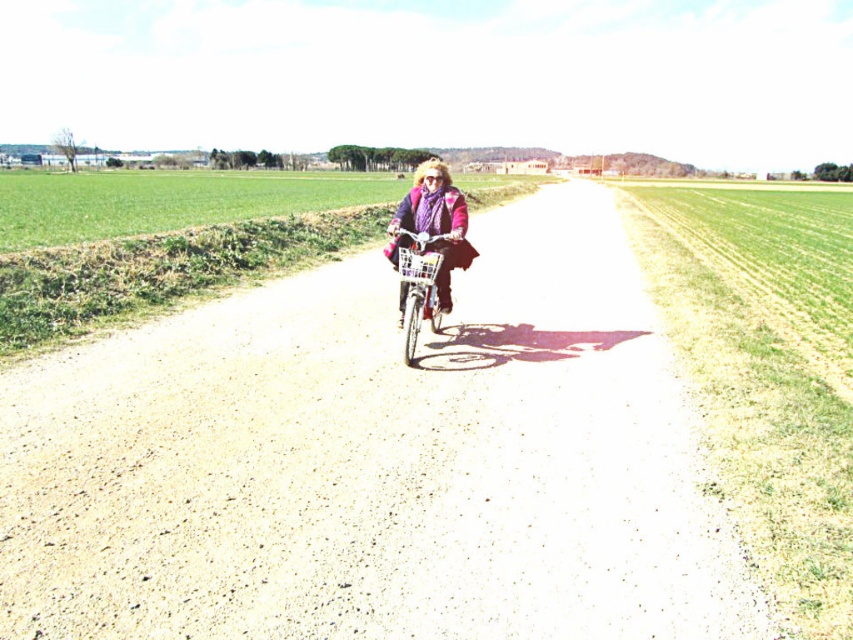
You are planning to ride a metallic silver bicycle at center along the gravel road at center. Considering the size difference between them, will the bicycle fit comfortably on the road?

The gravel road at center has a larger size compared to metallic silver bicycle at center, so the bicycle will fit comfortably on the road.

You are a cyclist planning to ride through the gravel road at center while wearing the matte purple sweater at center. Considering the road width, will your sweater interfere with your ability to ride safely?

The gravel road at center is wider than the matte purple sweater at center, so the sweater will not interfere with your ability to ride safely on the gravel road at center.